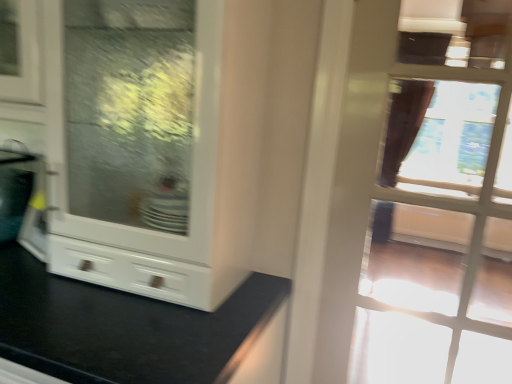
The image size is (512, 384). Identify the location of transparent glass door at upper right. (418, 193).

This screenshot has height=384, width=512. What do you see at coordinates (418, 193) in the screenshot?
I see `transparent glass door at upper right` at bounding box center [418, 193].

Measure the distance between transparent glass door at upper right and camera.

The depth of transparent glass door at upper right is 3.33 meters.

Describe the element at coordinates (142, 140) in the screenshot. I see `white glossy cabinet at center` at that location.

This screenshot has height=384, width=512. Find the location of `white glossy cabinet at center`. white glossy cabinet at center is located at coordinates (142, 140).

This screenshot has height=384, width=512. What are the coordinates of `transparent glass door at upper right` in the screenshot? It's located at (418, 193).

Considering the positions of objects white glossy cabinet at center and transparent glass door at upper right in the image provided, who is more to the right, white glossy cabinet at center or transparent glass door at upper right?

transparent glass door at upper right.

Considering the positions of objects white glossy cabinet at center and transparent glass door at upper right in the image provided, who is in front, white glossy cabinet at center or transparent glass door at upper right?

white glossy cabinet at center is more forward.

Is point (202, 34) more distant than point (355, 49)?

No, it is in front of (355, 49).

From the image's perspective, relative to transparent glass door at upper right, is white glossy cabinet at center above or below?

Based on their image positions, white glossy cabinet at center is located beneath transparent glass door at upper right.

From a real-world perspective, is white glossy cabinet at center positioned over transparent glass door at upper right based on gravity?

No, from a real-world perspective, white glossy cabinet at center is not above transparent glass door at upper right.

Is white glossy cabinet at center wider than transparent glass door at upper right?

Yes.

Considering the relative sizes of white glossy cabinet at center and transparent glass door at upper right in the image provided, is white glossy cabinet at center shorter than transparent glass door at upper right?

No.

Considering the sizes of objects white glossy cabinet at center and transparent glass door at upper right in the image provided, who is bigger, white glossy cabinet at center or transparent glass door at upper right?

Bigger between the two is white glossy cabinet at center.

Would you say white glossy cabinet at center is outside transparent glass door at upper right?

Yes.

Are white glossy cabinet at center and transparent glass door at upper right located far from each other?

Yes.

Is white glossy cabinet at center positioned with its back to transparent glass door at upper right?

No, white glossy cabinet at center's orientation is not away from transparent glass door at upper right.

At what (x,y) coordinates should I click in order to perform the action: click on door to the right of white glossy cabinet at center. Please return your answer as a coordinate pair (x, y). Looking at the image, I should click on (418, 193).

Is transparent glass door at upper right to the left or to the right of white glossy cabinet at center in the image?

transparent glass door at upper right is to the right of white glossy cabinet at center.

Does transparent glass door at upper right come in front of white glossy cabinet at center?

That is False.

Considering the positions of points (364, 342) and (236, 2), is point (364, 342) farther from camera compared to point (236, 2)?

Yes, point (364, 342) is farther from viewer.

From the image's perspective, would you say transparent glass door at upper right is positioned over white glossy cabinet at center?

Yes, from the image's perspective, transparent glass door at upper right is above white glossy cabinet at center.

From a real-world perspective, which object rests below the other?

white glossy cabinet at center is physically lower.

Considering the sizes of transparent glass door at upper right and white glossy cabinet at center in the image, is transparent glass door at upper right wider or thinner than white glossy cabinet at center?

Considering their sizes, transparent glass door at upper right looks slimmer than white glossy cabinet at center.

In the scene shown: Does transparent glass door at upper right have a lesser height compared to white glossy cabinet at center?

Yes.

Considering the sizes of transparent glass door at upper right and white glossy cabinet at center in the image, is transparent glass door at upper right bigger or smaller than white glossy cabinet at center?

In the image, transparent glass door at upper right appears to be smaller than white glossy cabinet at center.

Can white glossy cabinet at center be found inside transparent glass door at upper right?

Definitely not — white glossy cabinet at center is not inside transparent glass door at upper right.

Based on the photo, is transparent glass door at upper right not close to white glossy cabinet at center?

transparent glass door at upper right is positioned a significant distance from white glossy cabinet at center.

Is transparent glass door at upper right looking in the opposite direction of white glossy cabinet at center?

That's not correct — transparent glass door at upper right is not looking away from white glossy cabinet at center.

How many degrees apart are the facing directions of transparent glass door at upper right and white glossy cabinet at center?

There is a 0.371-degree angle between the facing directions of transparent glass door at upper right and white glossy cabinet at center.

I want to click on cabinetry in front of the transparent glass door at upper right, so click(142, 140).

At what (x,y) coordinates should I click in order to perform the action: click on cabinetry to the left of transparent glass door at upper right. Please return your answer as a coordinate pair (x, y). The image size is (512, 384). Looking at the image, I should click on (142, 140).

Find the location of a particular element. door above the white glossy cabinet at center (from the image's perspective) is located at coordinates (418, 193).